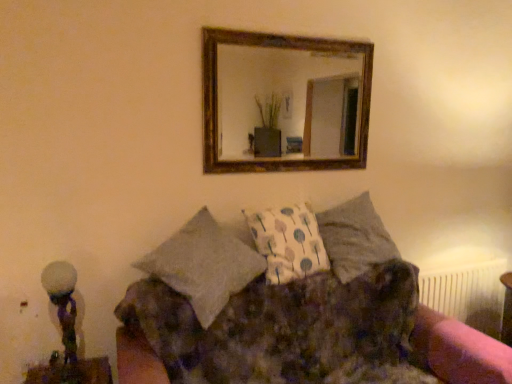
Question: Is textured gray pillow at center bigger than wooden-framed mirror at upper center?

Choices:
 (A) no
 (B) yes

Answer: (B)

Question: Considering the relative sizes of textured gray pillow at center and wooden-framed mirror at upper center in the image provided, is textured gray pillow at center taller than wooden-framed mirror at upper center?

Choices:
 (A) yes
 (B) no

Answer: (B)

Question: Is wooden-framed mirror at upper center located within textured gray pillow at center?

Choices:
 (A) no
 (B) yes

Answer: (A)

Question: Can you confirm if textured gray pillow at center is positioned to the left of wooden-framed mirror at upper center?

Choices:
 (A) no
 (B) yes

Answer: (A)

Question: From the image's perspective, is textured gray pillow at center over wooden-framed mirror at upper center?

Choices:
 (A) yes
 (B) no

Answer: (B)

Question: Can you confirm if textured gray pillow at center is thinner than wooden-framed mirror at upper center?

Choices:
 (A) yes
 (B) no

Answer: (B)

Question: From a real-world perspective, is fluffy fabric couch at center over wooden-framed mirror at upper center?

Choices:
 (A) yes
 (B) no

Answer: (B)

Question: Does fluffy fabric couch at center appear on the left side of wooden-framed mirror at upper center?

Choices:
 (A) no
 (B) yes

Answer: (A)

Question: Considering the relative sizes of fluffy fabric couch at center and wooden-framed mirror at upper center in the image provided, is fluffy fabric couch at center wider than wooden-framed mirror at upper center?

Choices:
 (A) yes
 (B) no

Answer: (A)

Question: From the image's perspective, does fluffy fabric couch at center appear higher than wooden-framed mirror at upper center?

Choices:
 (A) no
 (B) yes

Answer: (A)

Question: Is fluffy fabric couch at center bigger than wooden-framed mirror at upper center?

Choices:
 (A) no
 (B) yes

Answer: (B)

Question: Is fluffy fabric couch at center far away from wooden-framed mirror at upper center?

Choices:
 (A) yes
 (B) no

Answer: (A)

Question: From a real-world perspective, is white frosted glass at left on textured gray pillow at center?

Choices:
 (A) yes
 (B) no

Answer: (B)